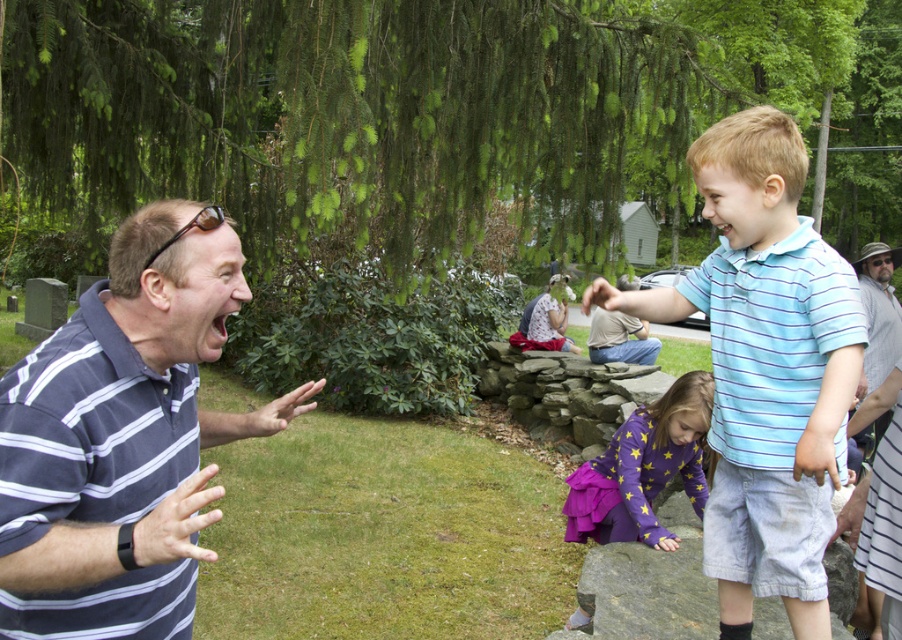
You are standing at the center of the image and want to locate the purple satin dress at lower center. According to the coordinates provided, in which direction should you move to find it?

The purple satin dress at lower center is located at point coordinates of [643,468]. Since you are at the center, you should move towards the lower right direction to find it.

You are a photographer trying to capture the scene. You want to ensure both the dark gray striped polo shirt at left and the gray cotton shirt at upper right are visible in your photo. Which shirt should you focus on to ensure both are in frame without zooming in or out?

The dark gray striped polo shirt at left has a lesser width compared to gray cotton shirt at upper right, so focusing on the gray cotton shirt at upper right would ensure both are visible since it is wider and might be more central.

Based on the scene description, which object is smaller in size between the dark gray striped polo shirt at left and the purple satin dress at lower center?

The dark gray striped polo shirt at left is smaller in size compared to the purple satin dress at lower center.